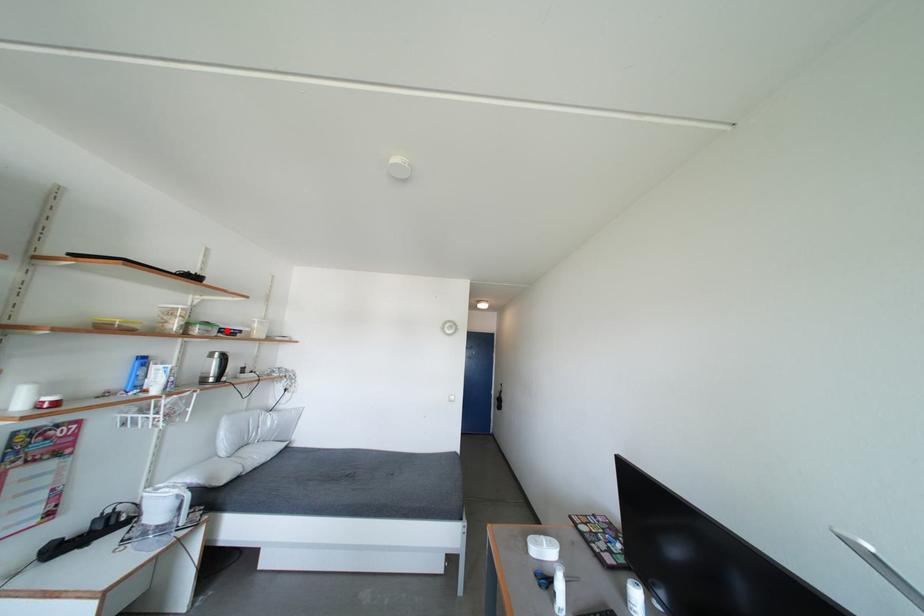
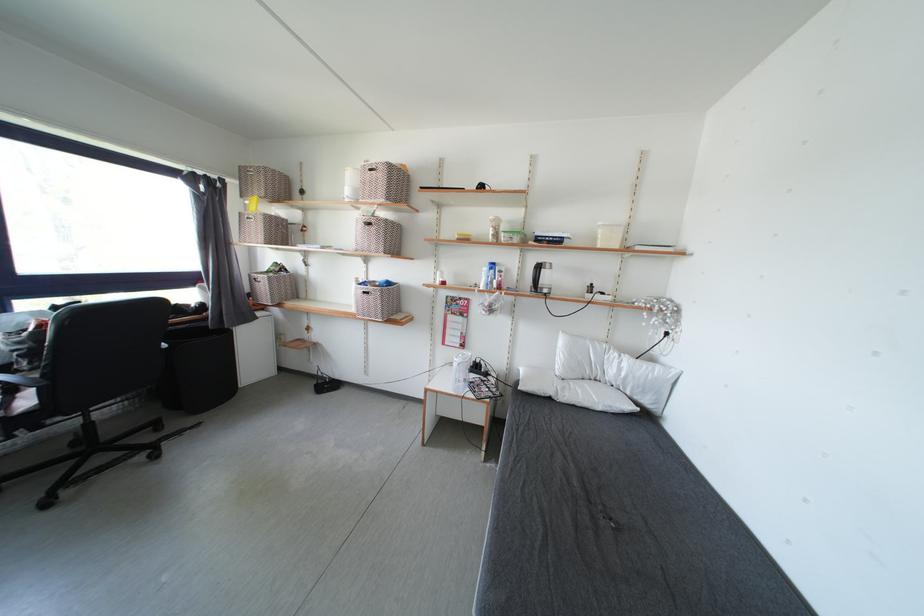
Question: I am providing you with two images of the same scene from different viewpoints. A red point is shown in image1. For the corresponding object point in image2, is it positioned nearer or farther from the camera?

Choices:
 (A) Nearer
 (B) Farther

Answer: (A)